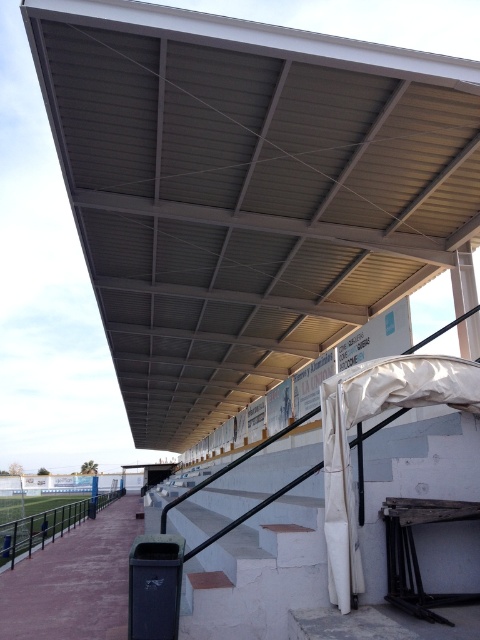
The height and width of the screenshot is (640, 480). What do you see at coordinates (247, 192) in the screenshot? I see `metallic gray roof at upper center` at bounding box center [247, 192].

Is metallic gray roof at upper center below brushed metal rail at lower left?

No, metallic gray roof at upper center is not below brushed metal rail at lower left.

Which is in front, point (305, 292) or point (82, 513)?

Positioned in front is point (305, 292).

Where is `metallic gray roof at upper center`? The image size is (480, 640). metallic gray roof at upper center is located at coordinates (247, 192).